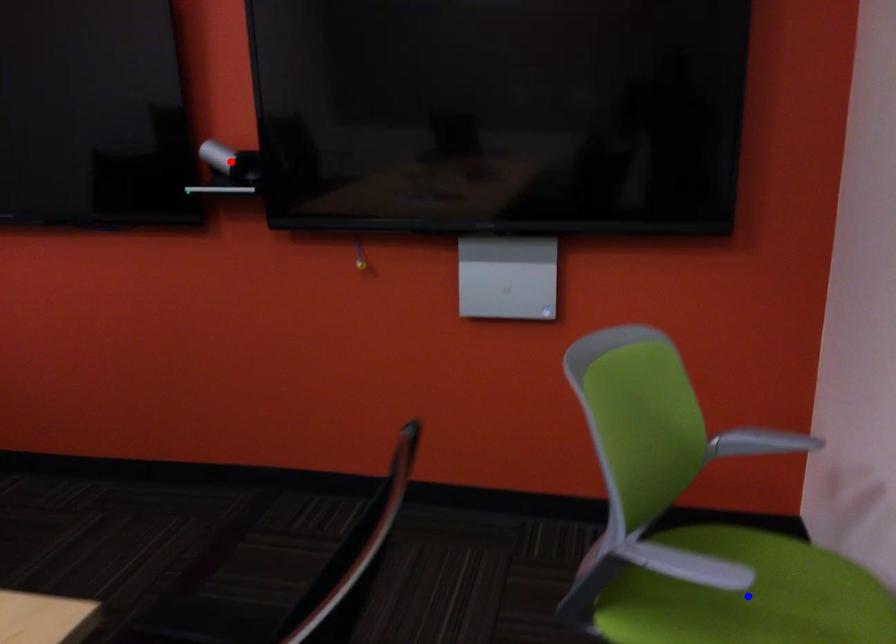
Question: In the image, two points are highlighted. Which point is nearer to the camera? Reply with the corresponding letter.

Choices:
 (A) blue point
 (B) red point

Answer: (A)